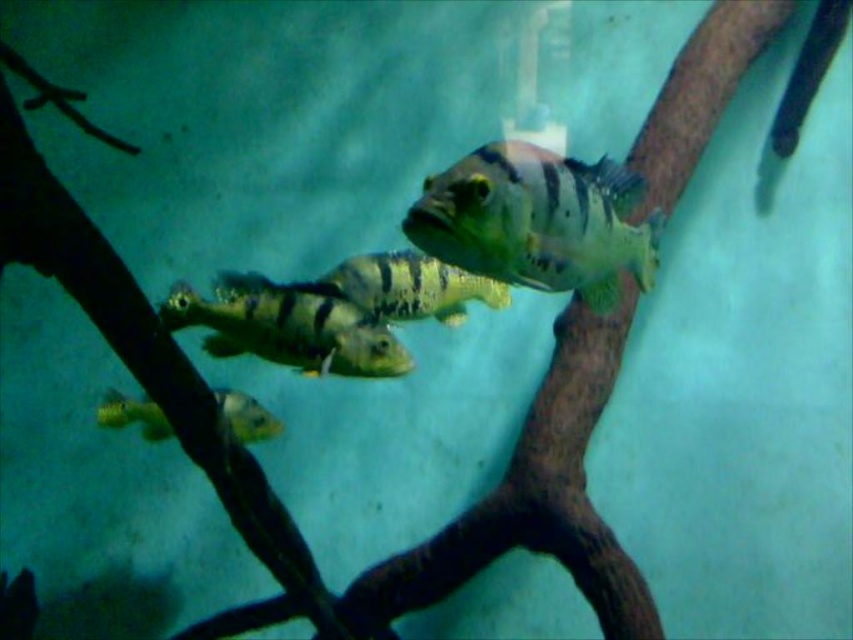
Is shiny green fish at center to the left of greenish-yellow striped fish at center from the viewer's perspective?

In fact, shiny green fish at center is to the right of greenish-yellow striped fish at center.

Is shiny green fish at center bigger than greenish-yellow striped fish at center?

Yes.

Who is more distant from viewer, (x=492, y=237) or (x=447, y=268)?

The point (x=447, y=268) is more distant.

This screenshot has height=640, width=853. What are the coordinates of `shiny green fish at center` in the screenshot? It's located at (537, 221).

Can you confirm if shiny green fish at center is bigger than green striped fish at center?

Correct, shiny green fish at center is larger in size than green striped fish at center.

Based on the photo, can you confirm if shiny green fish at center is positioned to the right of green striped fish at center?

Indeed, shiny green fish at center is positioned on the right side of green striped fish at center.

Between point (589, 172) and point (312, 304), which one is positioned in front?

Positioned in front is point (589, 172).

Image resolution: width=853 pixels, height=640 pixels. What are the coordinates of `shiny green fish at center` in the screenshot? It's located at (537, 221).

This screenshot has height=640, width=853. What do you see at coordinates (287, 326) in the screenshot?
I see `green striped fish at center` at bounding box center [287, 326].

Which is in front, point (230, 298) or point (149, 419)?

Point (230, 298) is more forward.

I want to click on green striped fish at center, so click(x=287, y=326).

Find the location of `green striped fish at center`. green striped fish at center is located at coordinates (287, 326).